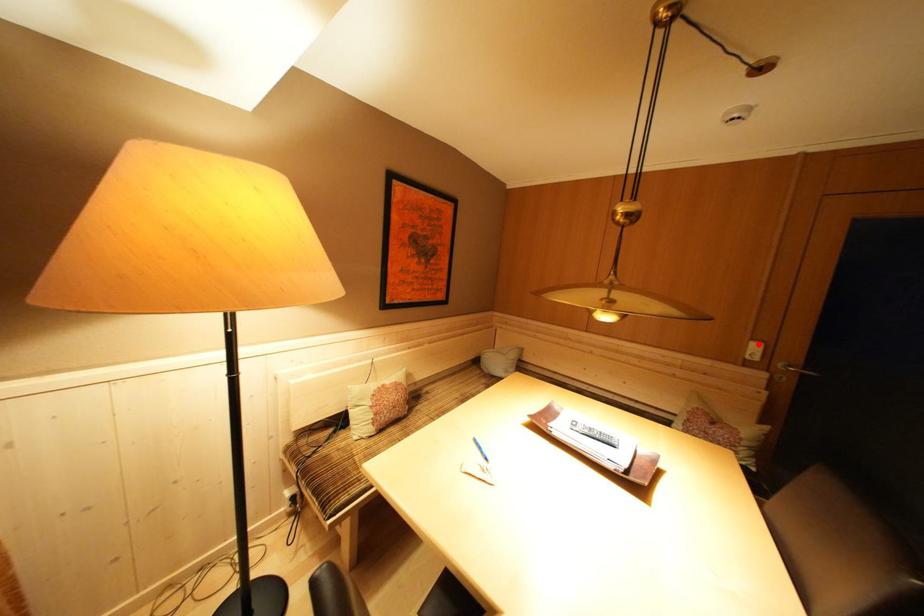
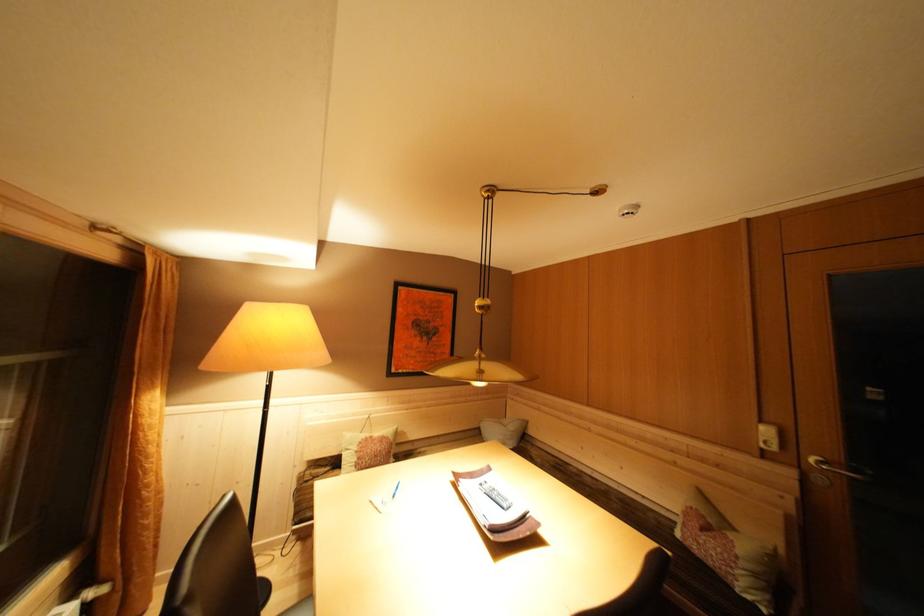
Locate, in the second image, the point that corresponds to the highlighted location in the first image.

(768, 427)